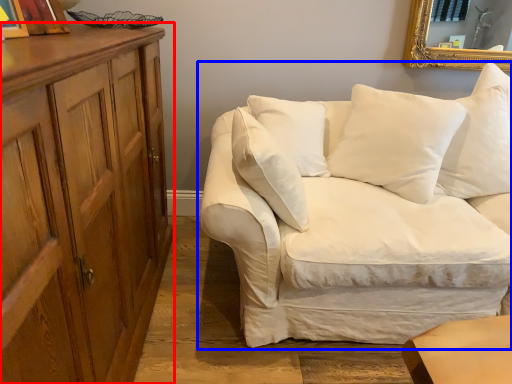
Question: Among these objects, which one is farthest to the camera, cabinetry (highlighted by a red box) or studio couch (highlighted by a blue box)?

Choices:
 (A) cabinetry
 (B) studio couch

Answer: (B)